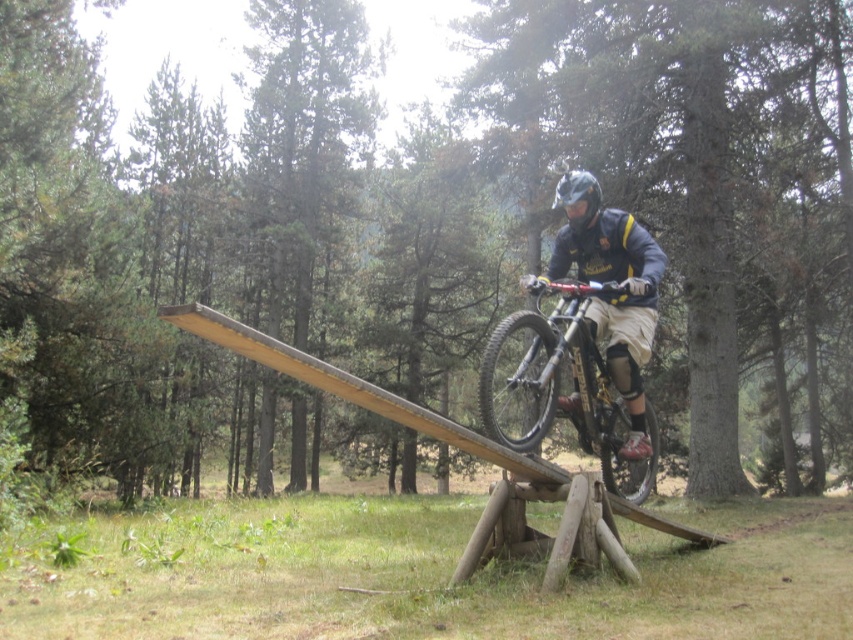
You are a photographer aiming to capture the mountain biker midair. You notice the shiny metallic bicycle at center and the matte black helmet at center. Which object appears larger in your photo?

The shiny metallic bicycle at center appears larger in the photo because it is closer to the viewer than the matte black helmet at center.

You are a photographer positioned at the point with coordinates point (560, 387). You want to capture the shiny metallic bicycle at center in your shot. Since you are at the point, can you see the shiny metallic bicycle at center in your current field of view?

Yes, the point (560, 387) indicates the location of the shiny metallic bicycle at center, so you are positioned exactly where the bicycle is. Therefore, you can see the shiny metallic bicycle at center in your current field of view.

You are a photographer trying to capture the perfect shot of the shiny metallic bicycle at center and the matte black helmet at center. Since you want to ensure both are visible clearly in the frame, which object should you focus on first to account for their size difference?

The shiny metallic bicycle at center is taller than the matte black helmet at center, so you should focus on the shiny metallic bicycle at center first to ensure its full height is captured before adjusting for the smaller matte black helmet at center.